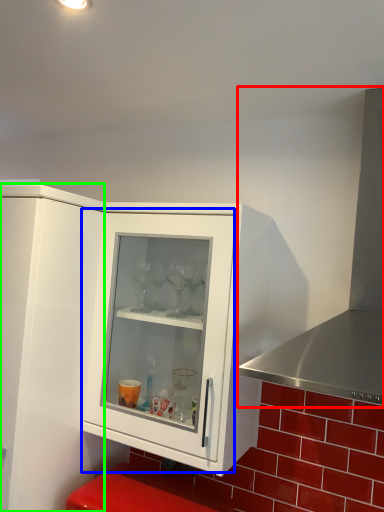
Question: Based on their relative distances, which object is nearer to exhaust hood (highlighted by a red box)? Choose from glass door (highlighted by a blue box) and cupboard (highlighted by a green box).

Choices:
 (A) glass door
 (B) cupboard

Answer: (A)